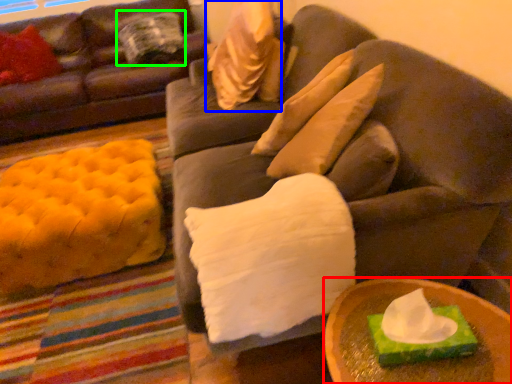
Question: Which object is positioned farthest from table (highlighted by a red box)? Select from pillow (highlighted by a blue box) and pillow (highlighted by a green box).

Choices:
 (A) pillow
 (B) pillow

Answer: (B)